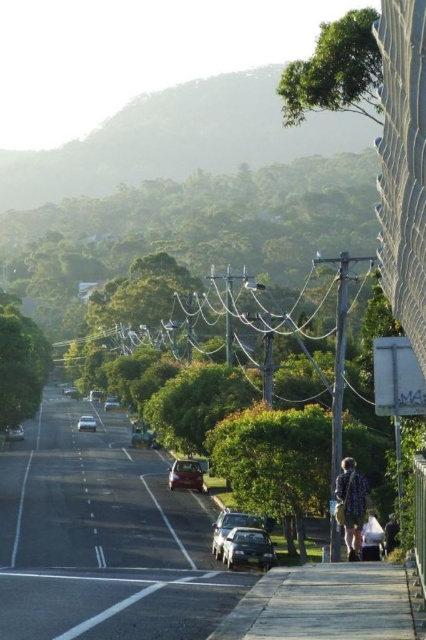
You are a delivery driver who needs to park your satin silver suv at lower center near the green leafy tree at upper right. Considering the size of the vehicle and the tree, will the tree block the parking space?

The green leafy tree at upper right is bigger than the satin silver suv at lower center. However, since the tree is located at the upper right and the suv is at the lower center, the tree might not directly block the parking space unless its branches extend downward. The description only mentions the tree is bigger in size, not specifying its canopy spread. Therefore, it is possible to park the suv at lower center near the tree without obstruction, but caution is advised if the branches are overhanging.

You are a pedestrian walking on the sidewalk on the right side of the street. You notice the green leafy tree at left and the shiny metallic car at center. Which object is casting a shadow over the other?

The green leafy tree at left is positioned over the shiny metallic car at center, so its shadow is likely falling onto the car.